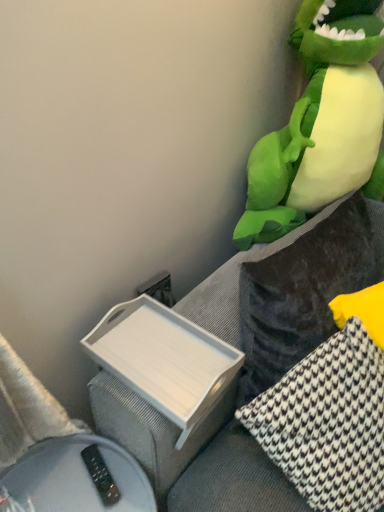
Question: Does green plush toy at upper right touch white plastic tray at lower left?

Choices:
 (A) no
 (B) yes

Answer: (A)

Question: Does green plush toy at upper right have a lesser height compared to white plastic tray at lower left?

Choices:
 (A) no
 (B) yes

Answer: (A)

Question: Would you say green plush toy at upper right is outside white plastic tray at lower left?

Choices:
 (A) yes
 (B) no

Answer: (A)

Question: Is green plush toy at upper right bigger than white plastic tray at lower left?

Choices:
 (A) no
 (B) yes

Answer: (B)

Question: Can you confirm if green plush toy at upper right is thinner than white plastic tray at lower left?

Choices:
 (A) yes
 (B) no

Answer: (B)

Question: Do you think white houndstooth fabric pillow at right, the 2th pillow positioned from the right, is within green plush toy at upper right, or outside of it?

Choices:
 (A) inside
 (B) outside

Answer: (B)

Question: From their relative heights in the image, would you say white houndstooth fabric pillow at right, the 2th pillow positioned from the right, is taller or shorter than green plush toy at upper right?

Choices:
 (A) tall
 (B) short

Answer: (B)

Question: From a real-world perspective, is white houndstooth fabric pillow at right, which appears as the 1th pillow when viewed from the left, positioned above or below green plush toy at upper right?

Choices:
 (A) below
 (B) above

Answer: (A)

Question: In the image, is white houndstooth fabric pillow at right, which appears as the 1th pillow when viewed from the left, positioned in front of or behind green plush toy at upper right?

Choices:
 (A) behind
 (B) front

Answer: (B)

Question: In the image, is velvet dark gray couch at right positioned in front of or behind white wood tray at lower left?

Choices:
 (A) behind
 (B) front

Answer: (B)

Question: Is point (248, 458) positioned closer to the camera than point (177, 398)?

Choices:
 (A) closer
 (B) farther

Answer: (B)

Question: Is velvet dark gray couch at right taller or shorter than white wood tray at lower left?

Choices:
 (A) short
 (B) tall

Answer: (B)

Question: Choose the correct answer: Is velvet dark gray couch at right inside white wood tray at lower left or outside it?

Choices:
 (A) inside
 (B) outside

Answer: (B)

Question: Based on their positions, is white houndstooth pillow at right, marked as the 1th pillow in a right-to-left arrangement, located to the left or right of white wood tray at lower left?

Choices:
 (A) right
 (B) left

Answer: (A)

Question: Looking at their shapes, would you say white houndstooth pillow at right, which ranks as the 2th pillow in left-to-right order, is wider or thinner than white wood tray at lower left?

Choices:
 (A) thin
 (B) wide

Answer: (B)